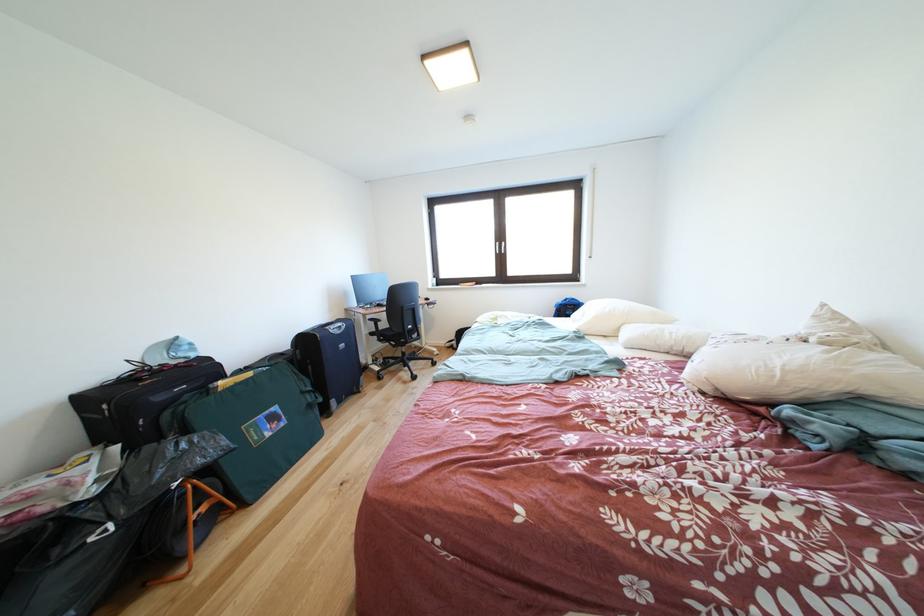
Describe the element at coordinates (800, 371) in the screenshot. I see `the long white pillow` at that location.